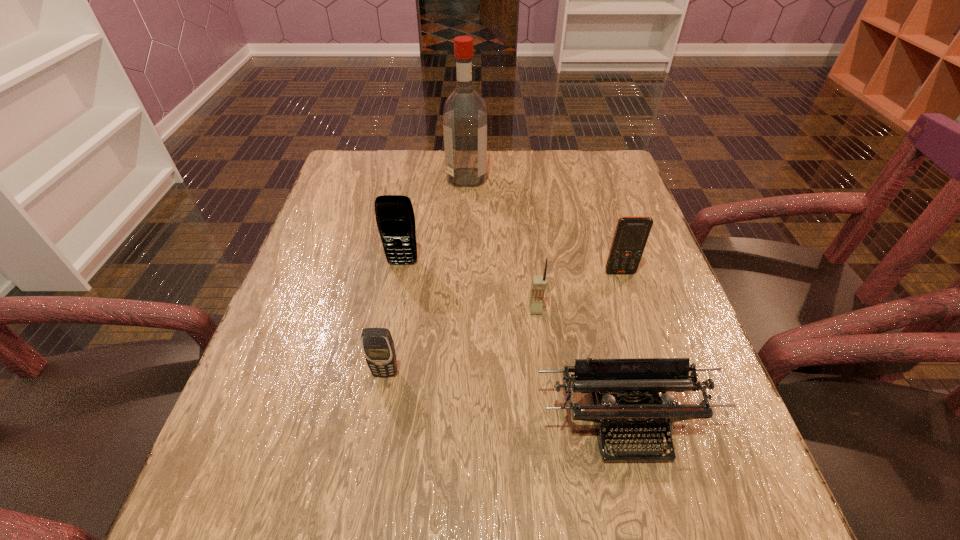
Where is `liquor`? liquor is located at coordinates pos(465,112).

Identify the location of the farthest object. (465, 112).

Locate an element on the screen. The image size is (960, 540). the second farthest object is located at coordinates (395, 219).

At what (x,y) coordinates should I click in order to perform the action: click on the second farthest cellular telephone. Please return your answer as a coordinate pair (x, y). The image size is (960, 540). Looking at the image, I should click on click(631, 234).

Locate an element on the screen. the third farthest object is located at coordinates (631, 234).

Locate an element on the screen. the third cellular telephone from left to right is located at coordinates (538, 285).

I want to click on the third farthest cellular telephone, so click(538, 285).

Find the location of a particular element. This screenshot has width=960, height=540. the shortest cellular telephone is located at coordinates (378, 347).

Where is `the fifth farthest object`? This screenshot has height=540, width=960. the fifth farthest object is located at coordinates (378, 347).

Locate an element on the screen. the shortest object is located at coordinates (628, 412).